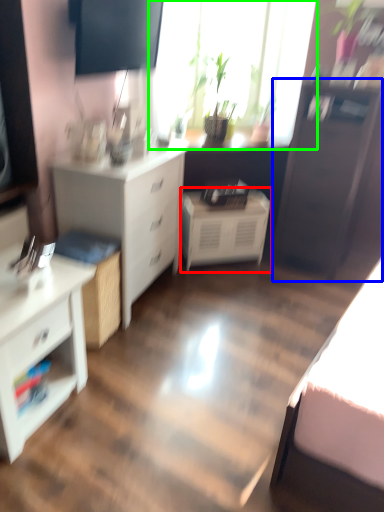
Question: Which object is positioned farthest from nightstand (highlighted by a red box)? Select from file cabinet (highlighted by a blue box) and window (highlighted by a green box).

Choices:
 (A) file cabinet
 (B) window

Answer: (B)